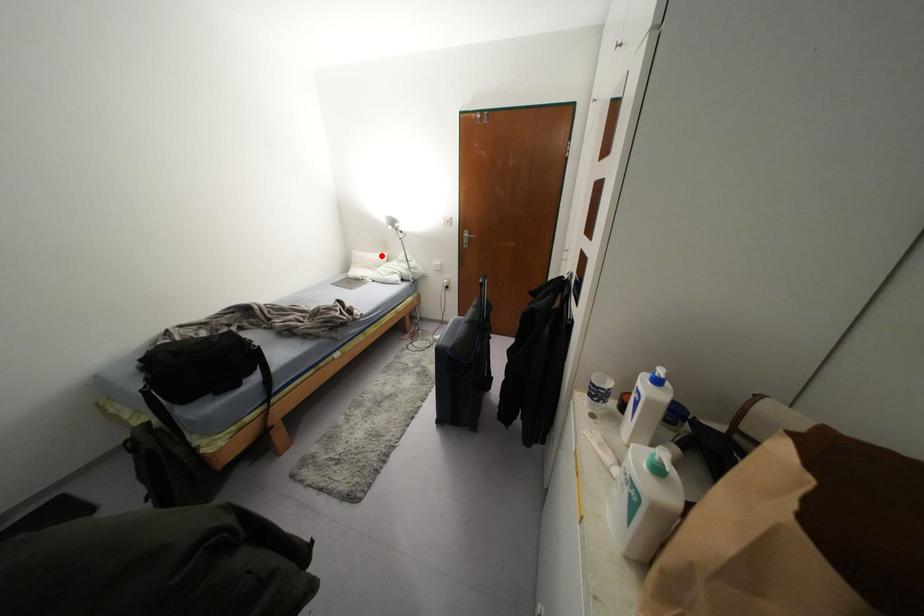
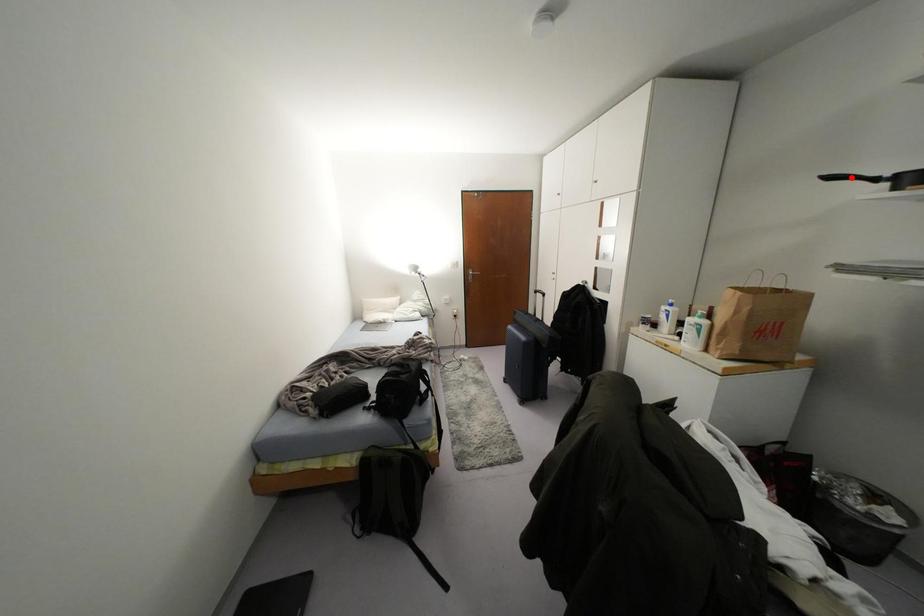
I am providing you with two images of the same scene from different viewpoints. A red point is marked on the first image and another point is marked on the second image. Are the points marked in image1 and image2 representing the same 3D position?

No